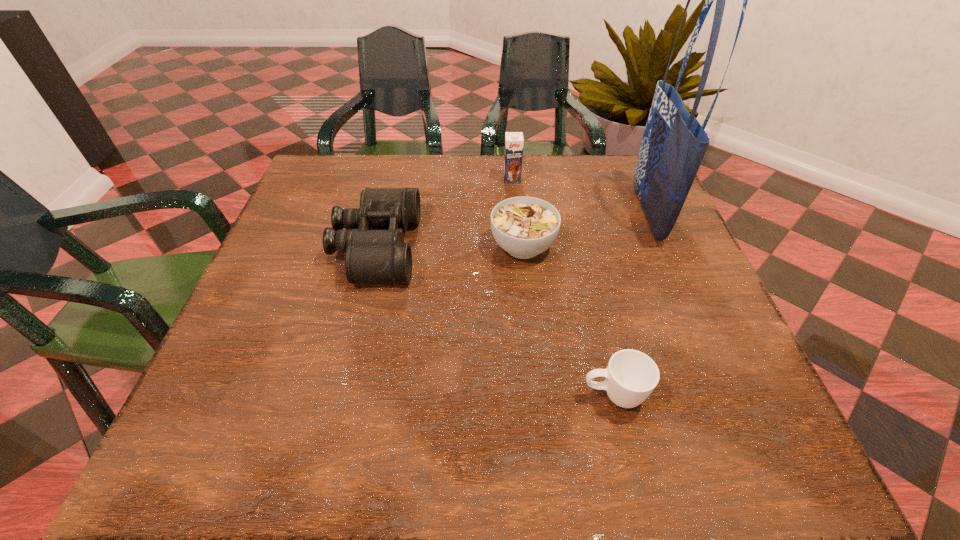
At what (x,y) coordinates should I click in order to perform the action: click on vacant space that is in between the nearest object and the second tallest object. Please return your answer as a coordinate pair (x, y). Looking at the image, I should click on (563, 287).

Locate an element on the screen. Image resolution: width=960 pixels, height=540 pixels. free space between the leftmost object and the nearest object is located at coordinates (x=494, y=321).

Locate an element on the screen. vacant space that's between the leftmost object and the chocolate milk is located at coordinates (444, 213).

You are a GUI agent. You are given a task and a screenshot of the screen. Output one action in this format:
    pyautogui.click(x=<x>, y=<y>)
    Task: Click on the vacant area that lies between the tallest object and the soup bowl
    Image resolution: width=960 pixels, height=540 pixels.
    Given the screenshot: What is the action you would take?
    coord(585,230)

The height and width of the screenshot is (540, 960). In order to click on free point between the shopping bag and the soup bowl in this screenshot , I will do `click(585, 230)`.

Where is `free space that is in between the cup and the rightmost object`? free space that is in between the cup and the rightmost object is located at coordinates (630, 305).

Find the location of a particular element. vacant region between the tallest object and the soup bowl is located at coordinates (585, 230).

Where is `free space that is in between the cup and the binoculars`? The width and height of the screenshot is (960, 540). free space that is in between the cup and the binoculars is located at coordinates (494, 321).

Identify which object is the closest to the leftmost object. Please provide its 2D coordinates. Your answer should be formatted as a tuple, i.e. [(x, y)], where the tuple contains the x and y coordinates of a point satisfying the conditions above.

[(524, 227)]

Point out which object is positioned as the third nearest to the fourth shortest object. Please provide its 2D coordinates. Your answer should be formatted as a tuple, i.e. [(x, y)], where the tuple contains the x and y coordinates of a point satisfying the conditions above.

[(674, 143)]